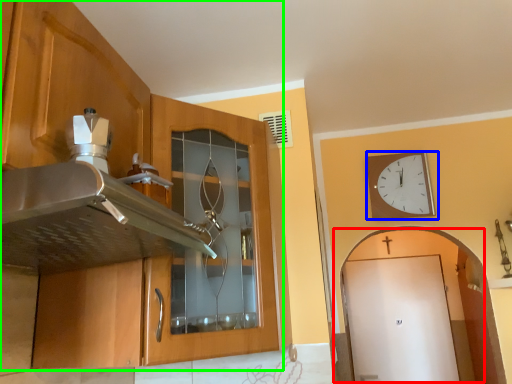
Question: Which is farther away from door (highlighted by a red box)? wall clock (highlighted by a blue box) or cabinetry (highlighted by a green box)?

Choices:
 (A) wall clock
 (B) cabinetry

Answer: (B)